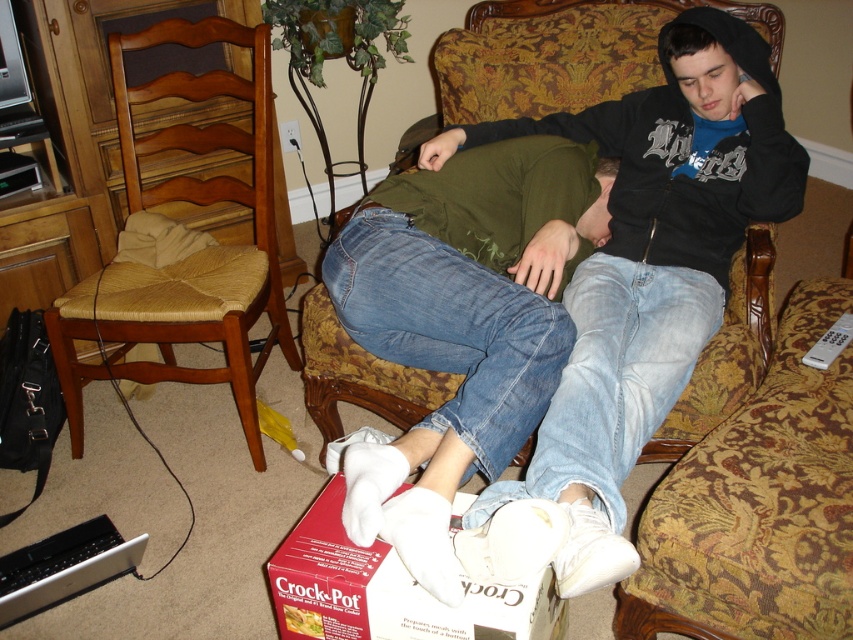
You are standing in the room and want to place a small plant between the two points, point (431, 588) and point (561, 612). Which point should the plant be closer to in order to be nearer to the viewer?

The plant should be closer to point (431, 588) because it is nearer to the viewer than point (561, 612).